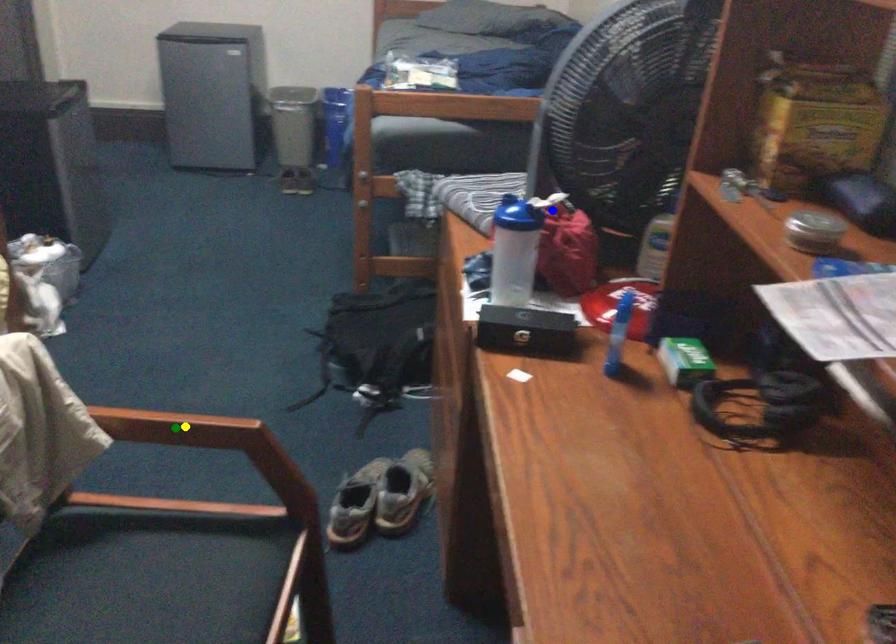
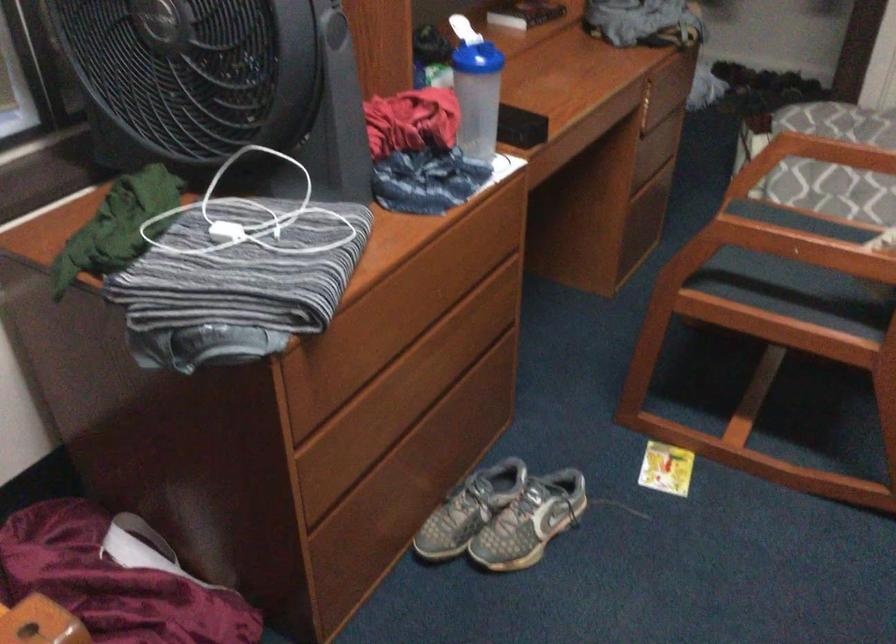
I am providing you with two images of the same scene from different viewpoints. Three points are marked in image1. Which point corresponds to a part or object that is occluded in image2?In image1, three points are marked. Which of them correspond to a part or object that is occluded in image2?Among the three points shown in image1, which one corresponds to a part or object that is no longer visible due to occlusion in image2?

Invisible in image2: green point.